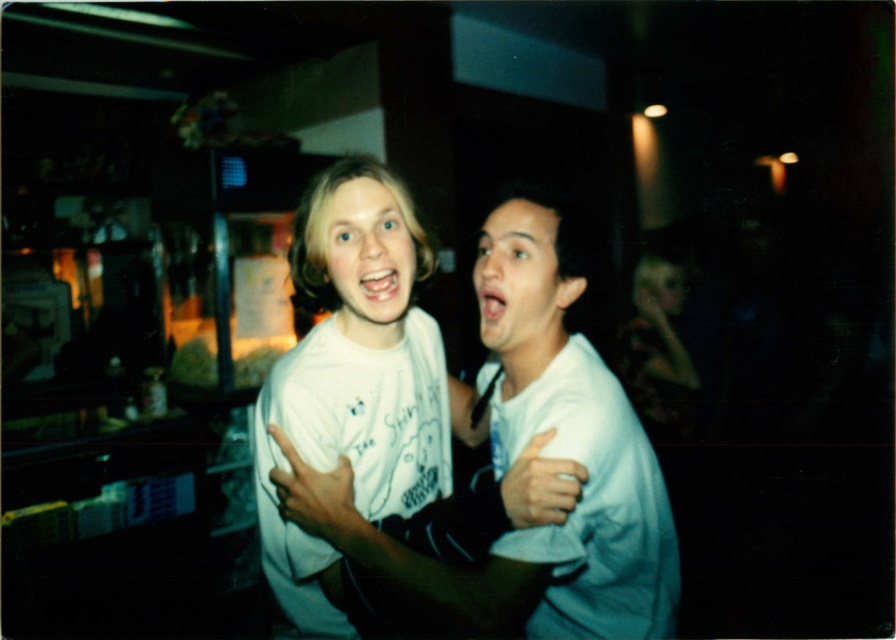
You are standing at the origin of the coordinate system in the image. You want to walk to point point (313, 563) and then to point (657, 308). Which point will you reach first?

You will reach point (313, 563) first because it is in front of point (657, 308).

You are a security camera in the room. You need to determine which hand is on the left side between the matte white hand at center and the white matte hand at center. Which one is on the left?

The matte white hand at center is positioned on the left side of the white matte hand at center.